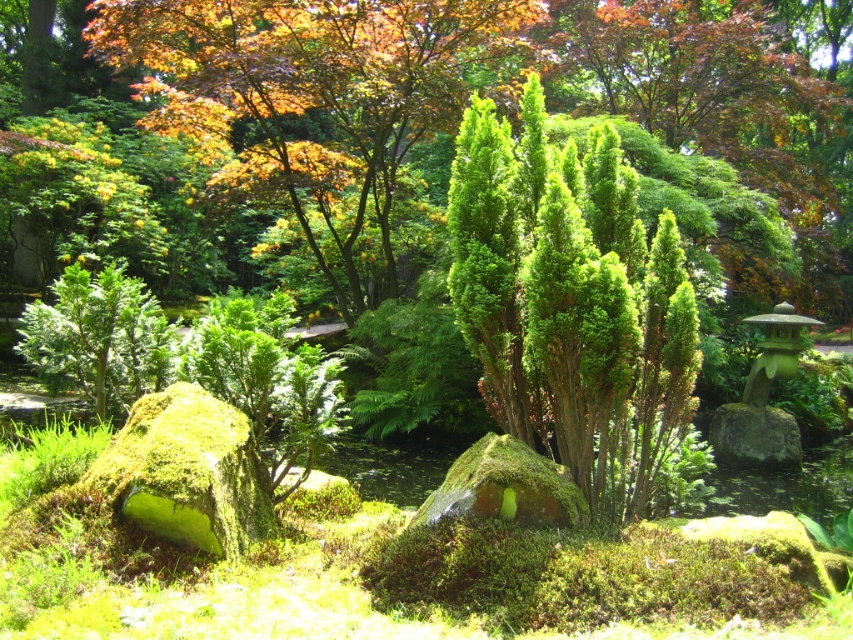
You are a gardener planning to prune the green textured bush at center and the green textured shrub at upper center. Which one should you start with if you want to work from the closest to the farthest?

You should start with the green textured bush at center because it is closer to the viewer than the green textured shrub at upper center.

You are standing in the Japanese garden and want to place a small decorative stone between the two points, point (668, 371) and point (433, 104). Which point should the stone be closer to in order to be nearer to the viewer?

The stone should be closer to point (668, 371) because it is closer to the viewer than point (433, 104).

You are a landscape designer planning to add a new plant to the Japanese garden. You have a small bonsai tree that is 30 cm tall. The green textured bush at center is currently blocking the view of the green textured shrub at upper center. If you place the bonsai tree between them, will it be visible from the garden path?

The green textured bush at center is bigger than the green textured shrub at upper center. Since the bonsai tree is only 30 cm tall, it might be obscured by the larger bush at center, making it less visible from the garden path.